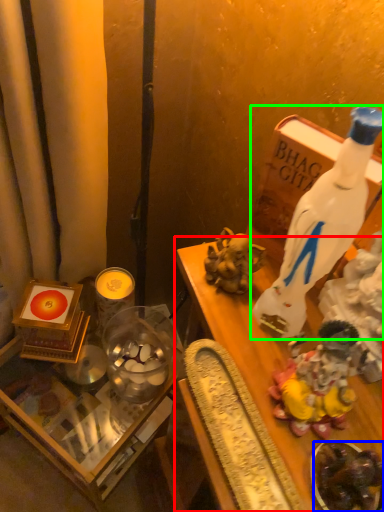
Question: Estimate the real-world distances between objects in this image. Which object is closer to furniture (highlighted by a red box), food (highlighted by a blue box) or bottle (highlighted by a green box)?

Choices:
 (A) food
 (B) bottle

Answer: (A)